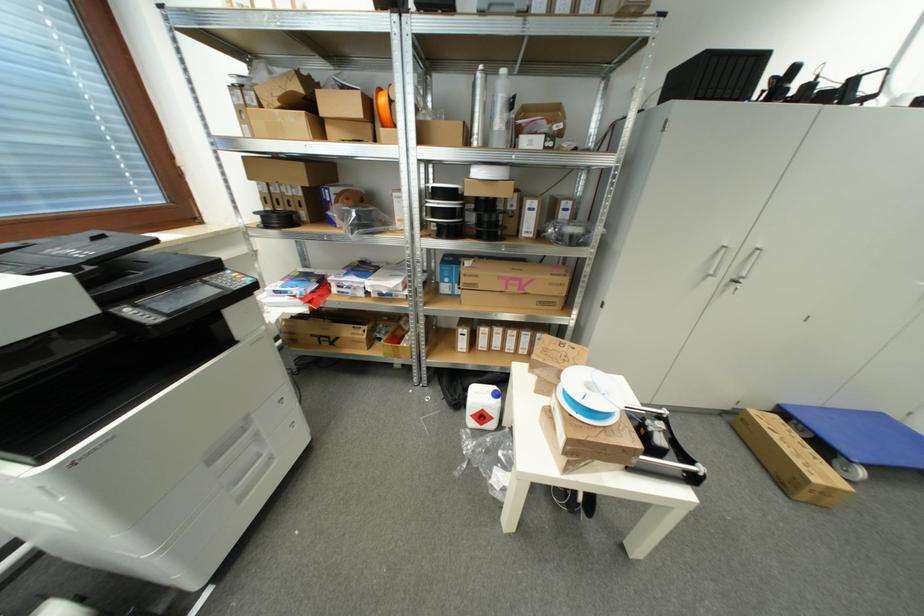
The height and width of the screenshot is (616, 924). I want to click on printer paper tray, so click(x=187, y=471).